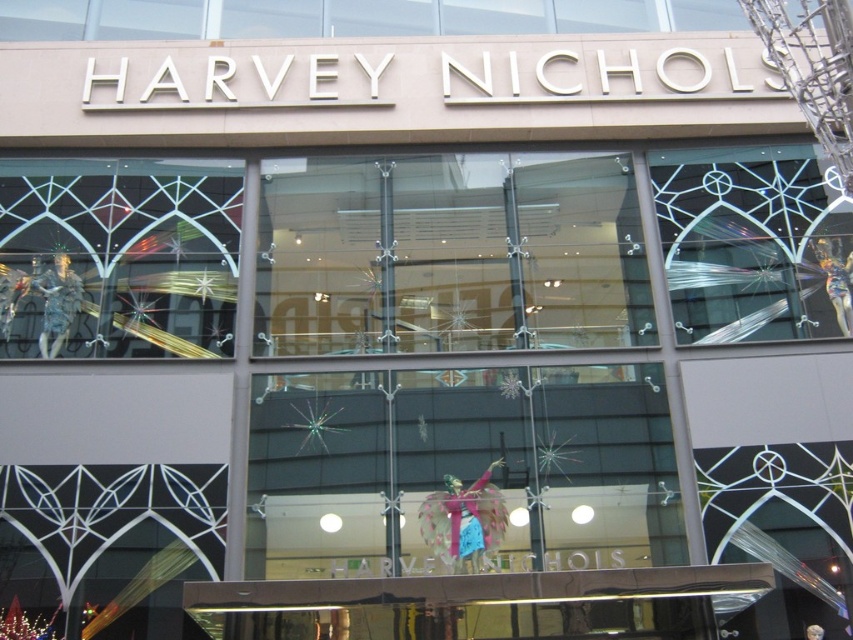
You are a window cleaner standing at the base of the Harvey Nichols store facade. You need to clean both the metallic silver mannequin at left and the clear glass window at upper right. Which object will require you to climb higher to reach?

The clear glass window at upper right requires climbing higher because the metallic silver mannequin at left is shorter in height compared to it.

You are standing in front of the Harvey Nichols store and notice the transparent glass angel at center. Where exactly is this angel positioned relative to the store facade?

The transparent glass angel at center is located at point coordinates of approximately 0.569 on the x axis and 0.536 on the y axis relative to the store facade.